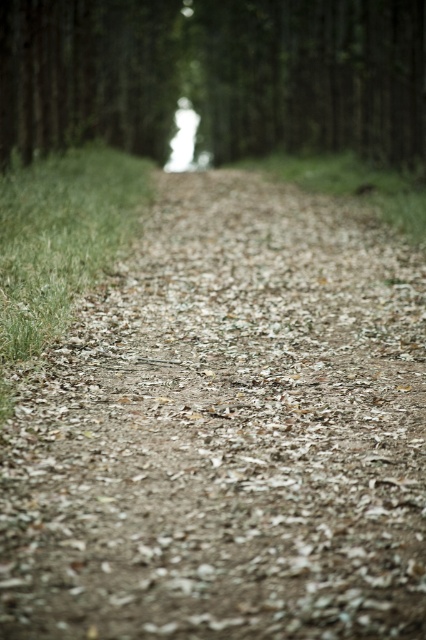
Can you confirm if brown dirt track at center is positioned to the left of green matte tree at center?

Incorrect, brown dirt track at center is not on the left side of green matte tree at center.

Can you confirm if brown dirt track at center is wider than green matte tree at center?

In fact, brown dirt track at center might be narrower than green matte tree at center.

Is point (204, 337) less distant than point (359, 68)?

Yes, it is in front of point (359, 68).

Find the location of `brown dirt track at center`. brown dirt track at center is located at coordinates (227, 433).